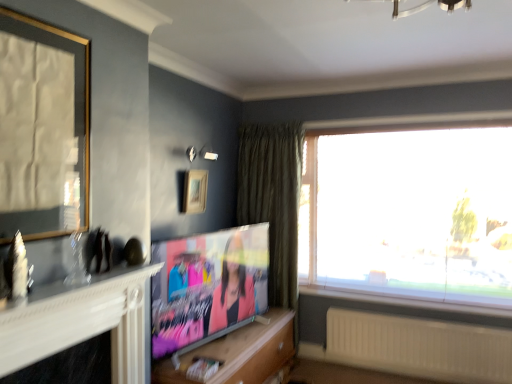
The height and width of the screenshot is (384, 512). I want to click on free point below matte black tv at center (from a real-world perspective), so click(229, 342).